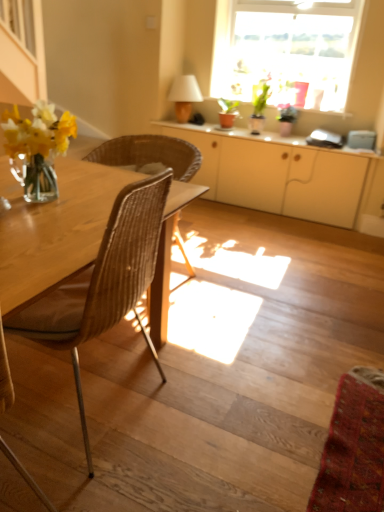
You are a GUI agent. You are given a task and a screenshot of the screen. Output one action in this format:
    pyautogui.click(x=<x>, y=<y>)
    Task: Click on the vacant area that is situated to the right of woven wood chair at left
    
    Given the screenshot: What is the action you would take?
    pyautogui.click(x=242, y=295)